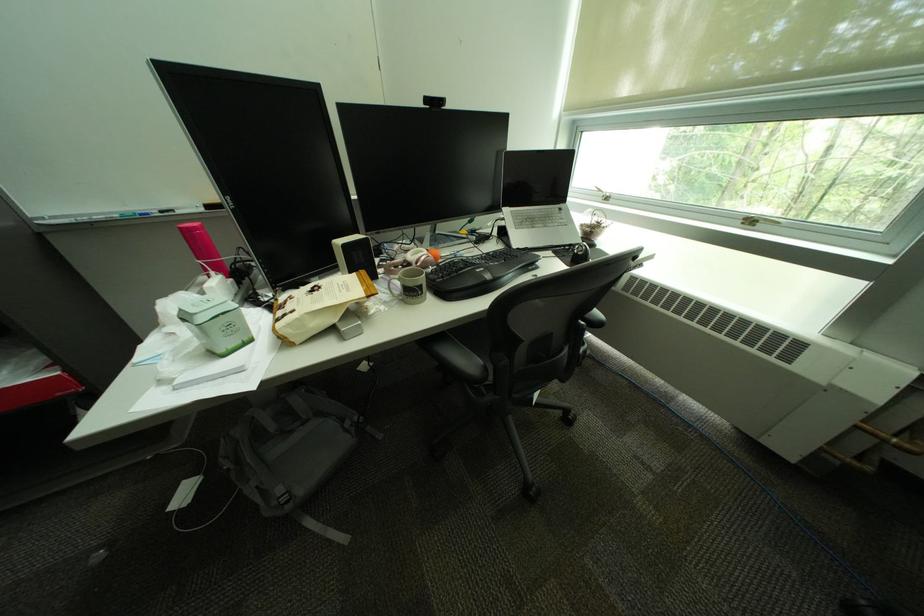
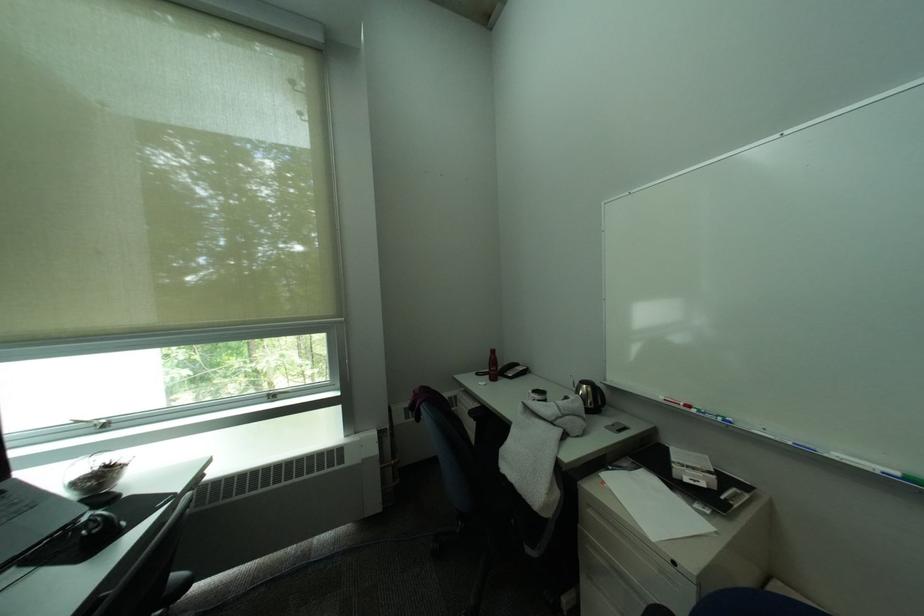
Find the pixel in the second image that matches point 591,252 in the first image.

(106, 528)